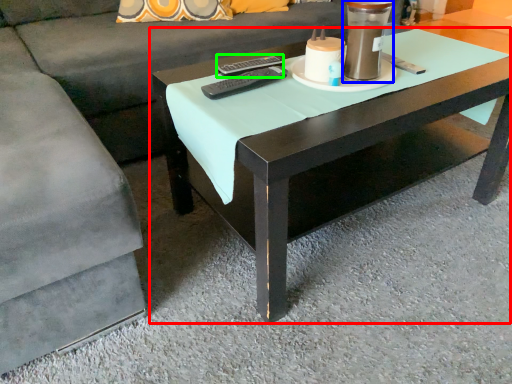
Question: Estimate the real-world distances between objects in this image. Which object is farther from coffee table (highlighted by a red box), candle holder (highlighted by a blue box) or remote (highlighted by a green box)?

Choices:
 (A) candle holder
 (B) remote

Answer: (B)